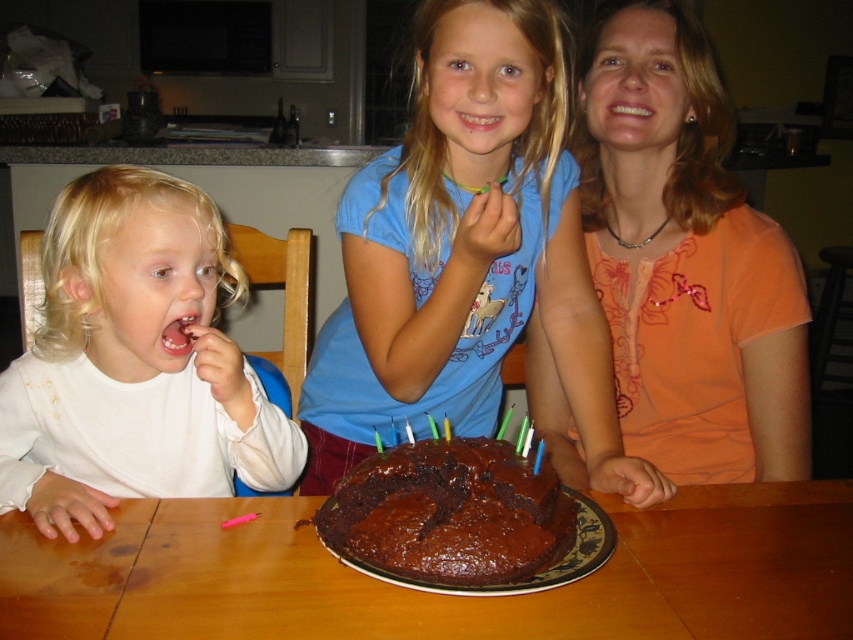
Consider the image. You are a guest at the birthday celebration and want to place a gift box on the table. The gift box is 10 cm wider than the chocolate matte cake at center. Can you fit the gift box on the brown wooden table at center without overlapping the cake?

The brown wooden table at center might be wider than chocolate matte cake at center. Since the gift box is 10 cm wider than the chocolate matte cake at center, there is a possibility that the table is wide enough to accommodate the gift box without overlapping the cake. However, without knowing the exact width difference between the table and the cake, it is uncertain. Please check the table dimensions before placing the gift box.